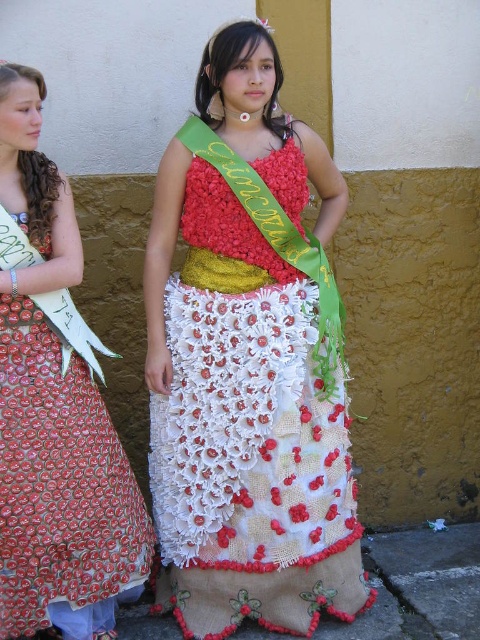
Does textured fabric dress at center appear on the left side of red dotted fabric dress at left?

Incorrect, textured fabric dress at center is not on the left side of red dotted fabric dress at left.

Is textured fabric dress at center shorter than red dotted fabric dress at left?

Incorrect, textured fabric dress at center's height does not fall short of red dotted fabric dress at left's.

Is point (181, 300) positioned after point (0, 211)?

That is True.

Identify the location of textured fabric dress at center. The height and width of the screenshot is (640, 480). (249, 362).